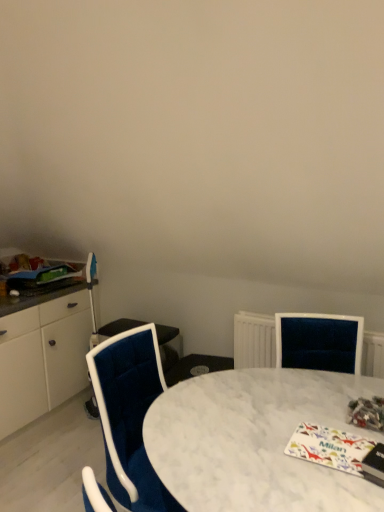
Question: From a real-world perspective, is velvet blue chair at center positioned over white marble table at center based on gravity?

Choices:
 (A) yes
 (B) no

Answer: (B)

Question: Does velvet blue chair at center appear on the right side of white marble table at center?

Choices:
 (A) no
 (B) yes

Answer: (A)

Question: Is white marble table at center completely or partially inside velvet blue chair at center?

Choices:
 (A) yes
 (B) no

Answer: (B)

Question: From the image's perspective, does velvet blue chair at center appear lower than white marble table at center?

Choices:
 (A) no
 (B) yes

Answer: (A)

Question: Can you confirm if velvet blue chair at center is smaller than white marble table at center?

Choices:
 (A) yes
 (B) no

Answer: (B)

Question: Is velvet blue chair at center bigger than white marble table at center?

Choices:
 (A) yes
 (B) no

Answer: (A)

Question: Can you confirm if white glossy magazine at lower right, the 2th magazine when ordered from front to back, is positioned to the left of multicolored glossy magazine at lower right, the 3th magazine from the back?

Choices:
 (A) yes
 (B) no

Answer: (A)

Question: Does white glossy magazine at lower right, the 2th magazine when ordered from left to right, have a smaller size compared to multicolored glossy magazine at lower right, the 1th magazine when ordered from right to left?

Choices:
 (A) yes
 (B) no

Answer: (A)

Question: Is white glossy magazine at lower right, which is the third magazine from top to bottom, facing away from multicolored glossy magazine at lower right, which is counted as the second magazine, starting from the bottom?

Choices:
 (A) yes
 (B) no

Answer: (B)

Question: Would you say white glossy magazine at lower right, the 1th magazine positioned from the bottom, is outside multicolored glossy magazine at lower right, the 3th magazine from the back?

Choices:
 (A) yes
 (B) no

Answer: (A)

Question: Is white glossy magazine at lower right, the 1th magazine positioned from the bottom, far from multicolored glossy magazine at lower right, the 1th magazine when ordered from right to left?

Choices:
 (A) yes
 (B) no

Answer: (B)

Question: Is multicolored glossy magazine at lower right, which is counted as the second magazine, starting from the bottom, a part of white glossy magazine at lower right, the 2th magazine viewed from the back?

Choices:
 (A) yes
 (B) no

Answer: (B)

Question: Can you confirm if white marble table at center is shorter than velvet blue chair at center?

Choices:
 (A) no
 (B) yes

Answer: (B)